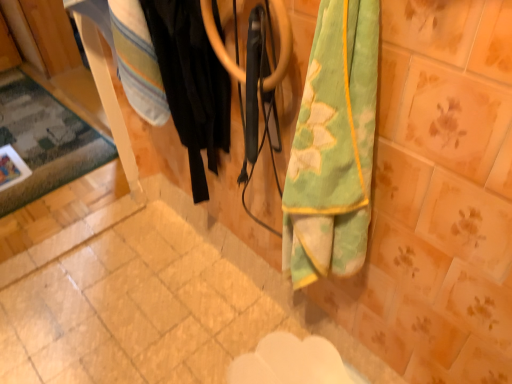
Question: Does carpeted rug at left have a lesser width compared to black fabric at center?

Choices:
 (A) yes
 (B) no

Answer: (B)

Question: Can you confirm if carpeted rug at left is wider than black fabric at center?

Choices:
 (A) yes
 (B) no

Answer: (A)

Question: Is carpeted rug at left facing away from black fabric at center?

Choices:
 (A) yes
 (B) no

Answer: (B)

Question: Can you confirm if carpeted rug at left is positioned to the left of black fabric at center?

Choices:
 (A) yes
 (B) no

Answer: (A)

Question: Is carpeted rug at left next to black fabric at center?

Choices:
 (A) yes
 (B) no

Answer: (B)

Question: From the image's perspective, is carpeted rug at left located above black fabric at center?

Choices:
 (A) yes
 (B) no

Answer: (A)

Question: Considering the relative sizes of black fabric at center and carpeted rug at left in the image provided, is black fabric at center wider than carpeted rug at left?

Choices:
 (A) yes
 (B) no

Answer: (B)

Question: Is black fabric at center not close to carpeted rug at left?

Choices:
 (A) no
 (B) yes

Answer: (B)

Question: Is black fabric at center smaller than carpeted rug at left?

Choices:
 (A) yes
 (B) no

Answer: (B)

Question: Is carpeted rug at left at the back of black fabric at center?

Choices:
 (A) no
 (B) yes

Answer: (A)

Question: Does black fabric at center appear on the right side of carpeted rug at left?

Choices:
 (A) yes
 (B) no

Answer: (A)

Question: From a real-world perspective, is black fabric at center located beneath carpeted rug at left?

Choices:
 (A) no
 (B) yes

Answer: (A)

Question: In terms of height, does carpeted rug at left look taller or shorter compared to black fabric at center?

Choices:
 (A) short
 (B) tall

Answer: (A)